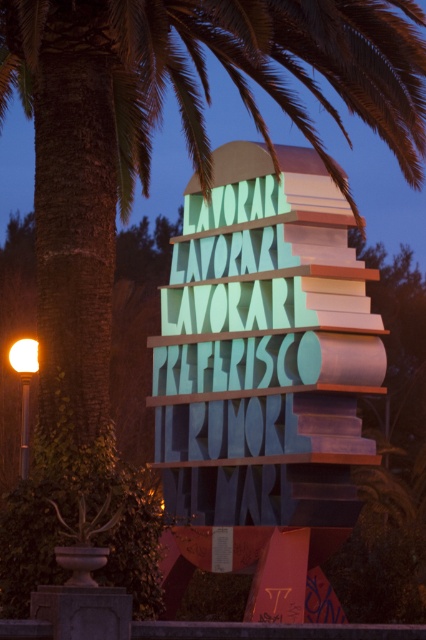
Between multicolored plastic sign at center and matte yellow light at left, which one is positioned lower?

matte yellow light at left is lower down.

Find the location of a particular element. Image resolution: width=426 pixels, height=640 pixels. multicolored plastic sign at center is located at coordinates [262, 374].

Which is in front, point (313, 150) or point (25, 374)?

Point (313, 150) is in front.

Image resolution: width=426 pixels, height=640 pixels. What are the coordinates of `multicolored plastic sign at center` in the screenshot? It's located at (262, 374).